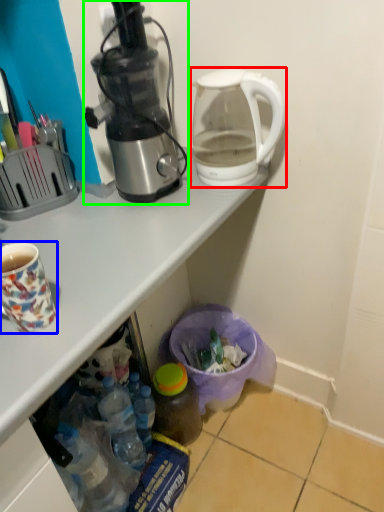
Question: Considering the real-world distances, which object is closest to kettle (highlighted by a red box)? coffee cup (highlighted by a blue box) or coffee maker (highlighted by a green box).

Choices:
 (A) coffee cup
 (B) coffee maker

Answer: (B)